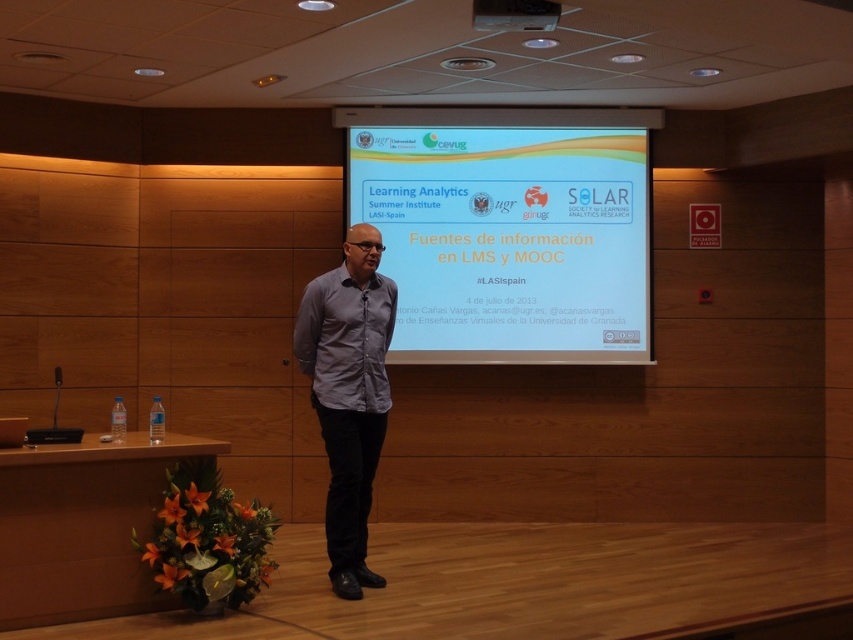
Is the position of gray matte shirt at center less distant than that of matte black projector at upper center?

No, it is behind matte black projector at upper center.

Which is in front, point (368, 404) or point (491, 4)?

Point (491, 4) is more forward.

Where is `gray matte shirt at center`? gray matte shirt at center is located at coordinates (347, 394).

Is white glossy projector screen at center to the left of matte black projector at upper center from the viewer's perspective?

Incorrect, white glossy projector screen at center is not on the left side of matte black projector at upper center.

Is white glossy projector screen at center shorter than matte black projector at upper center?

No.

Locate an element on the screen. The image size is (853, 640). white glossy projector screen at center is located at coordinates (509, 240).

Looking at this image, can you confirm if white glossy projector screen at center is positioned above gray matte shirt at center?

Correct, white glossy projector screen at center is located above gray matte shirt at center.

Between white glossy projector screen at center and gray matte shirt at center, which one is positioned lower?

Positioned lower is gray matte shirt at center.

Is point (587, 150) farther from viewer compared to point (372, 346)?

Yes, point (587, 150) is farther from viewer.

Image resolution: width=853 pixels, height=640 pixels. What are the coordinates of `white glossy projector screen at center` in the screenshot? It's located at (509, 240).